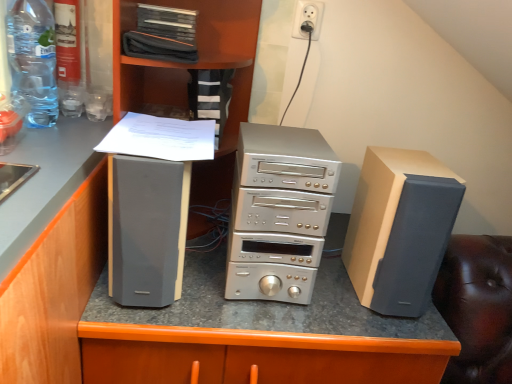
Where is `blank area to the left of silver metallic stereo stack at center`? Image resolution: width=512 pixels, height=384 pixels. blank area to the left of silver metallic stereo stack at center is located at coordinates pos(200,275).